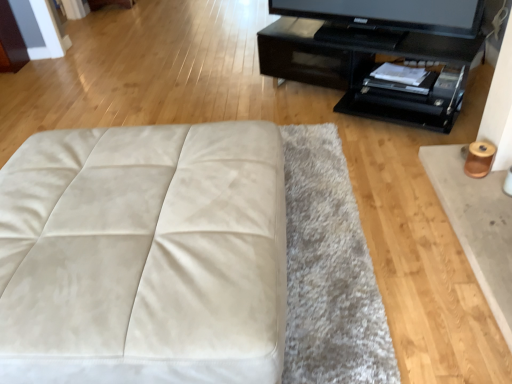
Question: Considering the relative sizes of black glossy tv stand at upper right and matte black television at upper right in the image provided, is black glossy tv stand at upper right shorter than matte black television at upper right?

Choices:
 (A) yes
 (B) no

Answer: (B)

Question: Does black glossy tv stand at upper right come in front of matte black television at upper right?

Choices:
 (A) no
 (B) yes

Answer: (B)

Question: Is black glossy tv stand at upper right positioned with its back to matte black television at upper right?

Choices:
 (A) yes
 (B) no

Answer: (B)

Question: Considering the relative sizes of black glossy tv stand at upper right and matte black television at upper right in the image provided, is black glossy tv stand at upper right smaller than matte black television at upper right?

Choices:
 (A) no
 (B) yes

Answer: (A)

Question: Considering the relative sizes of black glossy tv stand at upper right and matte black television at upper right in the image provided, is black glossy tv stand at upper right wider than matte black television at upper right?

Choices:
 (A) no
 (B) yes

Answer: (B)

Question: From the image's perspective, is white suede ottoman at center positioned above or below matte black television at upper right?

Choices:
 (A) above
 (B) below

Answer: (B)

Question: Is white suede ottoman at center in front of or behind matte black television at upper right in the image?

Choices:
 (A) front
 (B) behind

Answer: (A)

Question: Looking at the image, does white suede ottoman at center seem bigger or smaller compared to matte black television at upper right?

Choices:
 (A) big
 (B) small

Answer: (A)

Question: Considering the positions of point (159, 345) and point (406, 13), is point (159, 345) closer or farther from the camera than point (406, 13)?

Choices:
 (A) closer
 (B) farther

Answer: (A)

Question: Is matte black television at upper right situated inside white suede ottoman at center or outside?

Choices:
 (A) outside
 (B) inside

Answer: (A)

Question: Considering their positions, is matte black television at upper right located in front of or behind white suede ottoman at center?

Choices:
 (A) front
 (B) behind

Answer: (B)

Question: From the image's perspective, is matte black television at upper right positioned above or below white suede ottoman at center?

Choices:
 (A) above
 (B) below

Answer: (A)

Question: In the image, is matte black television at upper right on the left side or the right side of white suede ottoman at center?

Choices:
 (A) left
 (B) right

Answer: (B)

Question: Does point (322, 46) appear closer or farther from the camera than point (404, 16)?

Choices:
 (A) closer
 (B) farther

Answer: (B)

Question: In terms of size, does black glossy tv stand at upper right appear bigger or smaller than matte black television at upper right?

Choices:
 (A) small
 (B) big

Answer: (B)